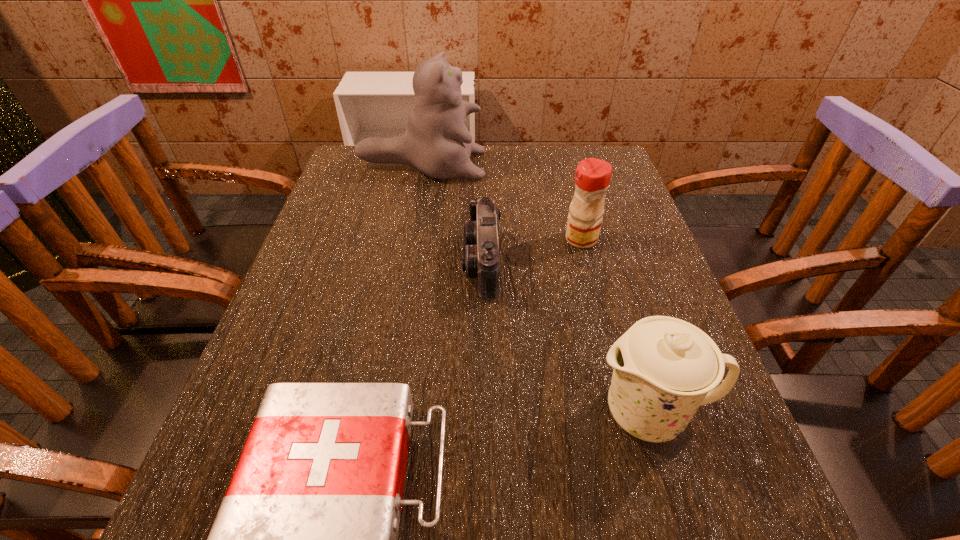
Locate an element on the screen. The width and height of the screenshot is (960, 540). free space at the left edge is located at coordinates (x=356, y=272).

Locate an element on the screen. vacant space at the right edge of the desktop is located at coordinates (621, 228).

In the image, there is a desktop. Where is `free region at the far left corner`? Image resolution: width=960 pixels, height=540 pixels. free region at the far left corner is located at coordinates (377, 168).

Where is `blank space at the near right corner of the desktop`? The height and width of the screenshot is (540, 960). blank space at the near right corner of the desktop is located at coordinates (667, 493).

This screenshot has height=540, width=960. I want to click on vacant point located between the cat and the condiment, so [x=501, y=202].

Find the location of a particular element. The image size is (960, 540). empty space between the second shortest object and the condiment is located at coordinates coord(532,251).

Where is `empty location between the chinaware and the condiment`? empty location between the chinaware and the condiment is located at coordinates (615, 326).

The width and height of the screenshot is (960, 540). What are the coordinates of `free spot between the farthest object and the condiment` in the screenshot? It's located at (501, 202).

The image size is (960, 540). I want to click on free space between the fourth tallest object and the chinaware, so click(566, 338).

Identify the location of the fourth closest object relative to the shortest object. (436, 142).